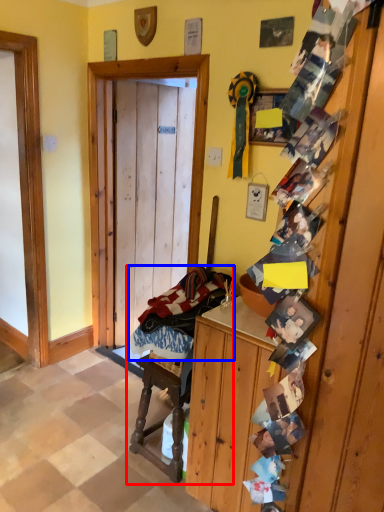
Question: Which object appears farthest to the camera in this image, rocking chair (highlighted by a red box) or laundry (highlighted by a blue box)?

Choices:
 (A) rocking chair
 (B) laundry

Answer: (A)